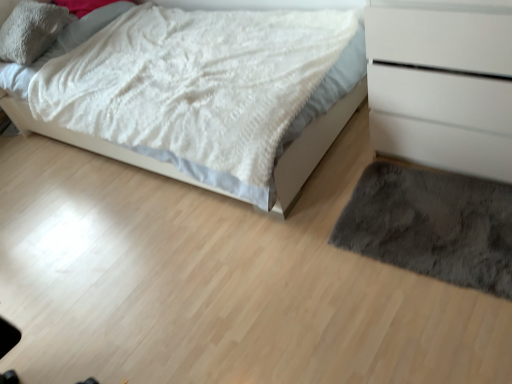
Image resolution: width=512 pixels, height=384 pixels. In order to click on vacant area that is in front of white fluffy blanket at upper left in this screenshot , I will do `click(193, 273)`.